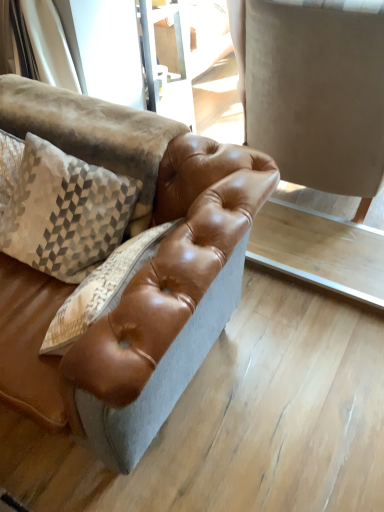
Question: From a real-world perspective, does light brown leather table at center sit lower than textured beige pillow at upper left?

Choices:
 (A) no
 (B) yes

Answer: (B)

Question: Is the position of light brown leather table at center less distant than that of textured beige pillow at upper left?

Choices:
 (A) no
 (B) yes

Answer: (A)

Question: Is light brown leather table at center oriented towards textured beige pillow at upper left?

Choices:
 (A) no
 (B) yes

Answer: (A)

Question: Is the position of light brown leather table at center more distant than that of textured beige pillow at upper left?

Choices:
 (A) yes
 (B) no

Answer: (A)

Question: From a real-world perspective, is light brown leather table at center positioned over textured beige pillow at upper left based on gravity?

Choices:
 (A) yes
 (B) no

Answer: (B)

Question: Is light brown leather table at center next to textured beige pillow at upper left?

Choices:
 (A) no
 (B) yes

Answer: (A)

Question: Can light brown leather table at center be found inside brown leather swivel chair at center?

Choices:
 (A) no
 (B) yes

Answer: (A)

Question: Can you confirm if brown leather swivel chair at center is smaller than light brown leather table at center?

Choices:
 (A) no
 (B) yes

Answer: (A)

Question: Can you confirm if brown leather swivel chair at center is shorter than light brown leather table at center?

Choices:
 (A) no
 (B) yes

Answer: (A)

Question: Is brown leather swivel chair at center turned away from light brown leather table at center?

Choices:
 (A) no
 (B) yes

Answer: (B)

Question: From a real-world perspective, is brown leather swivel chair at center over light brown leather table at center?

Choices:
 (A) no
 (B) yes

Answer: (B)

Question: From the image's perspective, does brown leather swivel chair at center appear lower than light brown leather table at center?

Choices:
 (A) yes
 (B) no

Answer: (B)

Question: Are textured beige pillow at upper left and light brown leather table at center located far from each other?

Choices:
 (A) no
 (B) yes

Answer: (A)